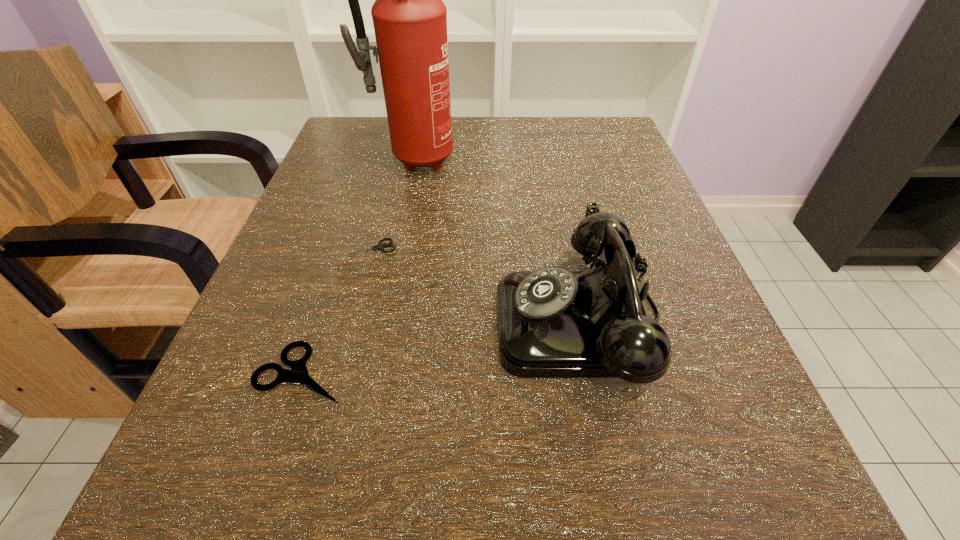
The image size is (960, 540). Find the location of `free space located 0.160m on the dial of the rightmost object`. free space located 0.160m on the dial of the rightmost object is located at coordinates (381, 321).

Locate an element on the screen. vacant space located on the dial of the rightmost object is located at coordinates (360, 321).

Image resolution: width=960 pixels, height=540 pixels. Find the location of `vacant space located on the right of the taller shears`. vacant space located on the right of the taller shears is located at coordinates (486, 373).

Image resolution: width=960 pixels, height=540 pixels. What are the coordinates of `vacant space located 0.340m on the right of the shorter shears` in the screenshot? It's located at (606, 249).

The width and height of the screenshot is (960, 540). Identify the location of object positioned at the far edge. (410, 19).

The image size is (960, 540). What are the coordinates of `fire extinguisher located at the left edge` in the screenshot? It's located at (410, 19).

In order to click on object at the right edge in this screenshot , I will do `click(552, 323)`.

Where is `object that is at the far left corner`? This screenshot has height=540, width=960. object that is at the far left corner is located at coordinates (410, 19).

What are the coordinates of `free space at the far edge` in the screenshot? It's located at (464, 122).

The width and height of the screenshot is (960, 540). What are the coordinates of `free space at the near edge of the desktop` in the screenshot? It's located at (575, 523).